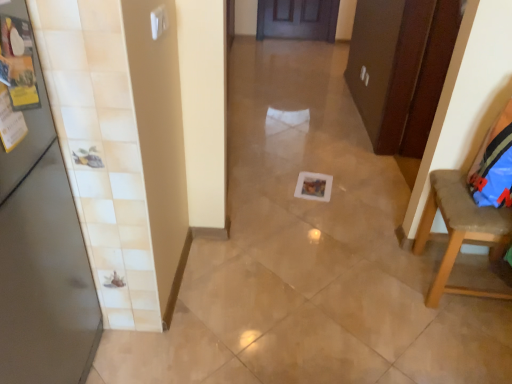
Identify the location of free region under brown fabric chair at right (from a real-world perspective). Image resolution: width=512 pixels, height=384 pixels. (475, 284).